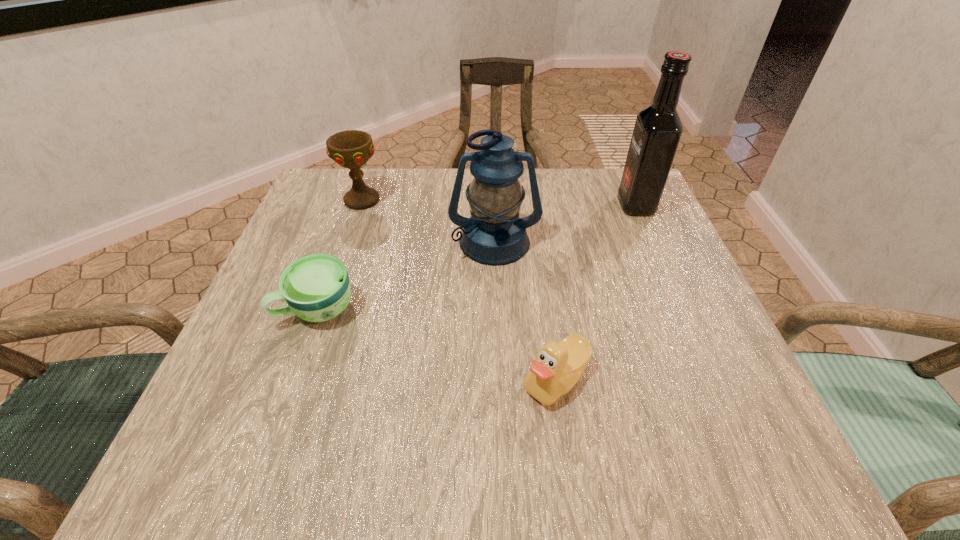
What are the coordinates of `vacant space positioned on the front-facing side of the liquor` in the screenshot? It's located at (453, 205).

The image size is (960, 540). I want to click on vacant space located on the front-facing side of the liquor, so click(x=504, y=205).

I want to click on free space located 0.060m on the face of the fourth shortest object, so point(496,287).

Locate an element on the screen. The height and width of the screenshot is (540, 960). vacant region located 0.070m on the back of the chalice is located at coordinates (372, 173).

Where is `free space located at the beak of the nearest object`? This screenshot has height=540, width=960. free space located at the beak of the nearest object is located at coordinates (471, 380).

Identify the location of vacant space located 0.330m at the beak of the nearest object. The image size is (960, 540). (313, 380).

Identify the location of free space located at the beak of the nearest object. Image resolution: width=960 pixels, height=540 pixels. (427, 380).

You are a GUI agent. You are given a task and a screenshot of the screen. Output one action in this format:
    pyautogui.click(x=<x>, y=<y>)
    Task: Click on the vacant position located on the back of the cup
    The height and width of the screenshot is (540, 960).
    Given the screenshot: What is the action you would take?
    pyautogui.click(x=335, y=259)

Identify the location of liquor at the far edge. pyautogui.click(x=658, y=128).

Locate an element on the screen. The height and width of the screenshot is (540, 960). lantern situated at the far edge is located at coordinates pyautogui.click(x=494, y=235).